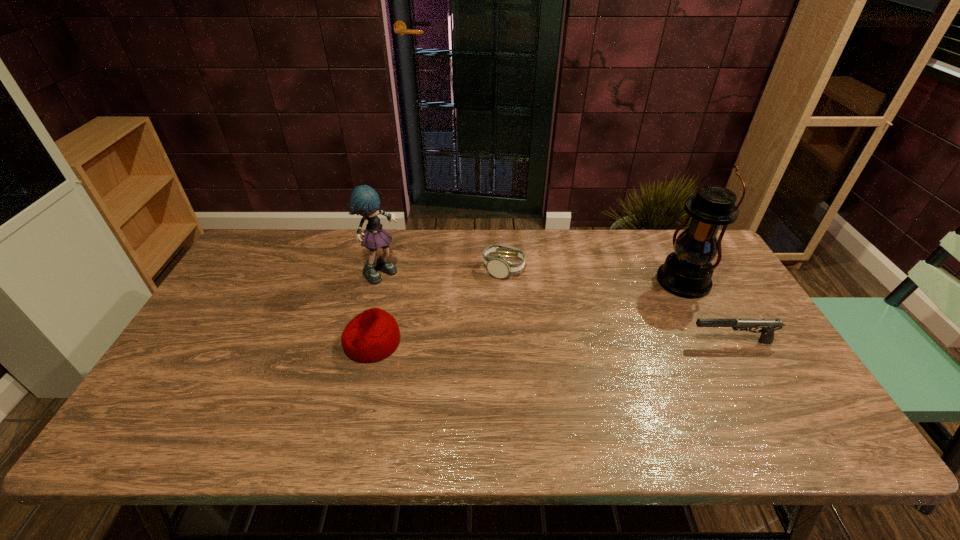
At what (x,y) coordinates should I click in order to perform the action: click on vacant spot on the desktop that is between the beanbag and the gun and is positioned on the front-facing side of the fourth shortest object. Please return your answer as a coordinate pair (x, y). Looking at the image, I should click on (526, 342).

Identify the location of vacant spot on the desktop that is between the beanbag and the gun and is positioned on the face of the watch. (574, 342).

In order to click on vacant spot on the desktop that is between the beanbag and the gun and is positioned above the tallest object, indicating its light source in this screenshot , I will do `click(568, 342)`.